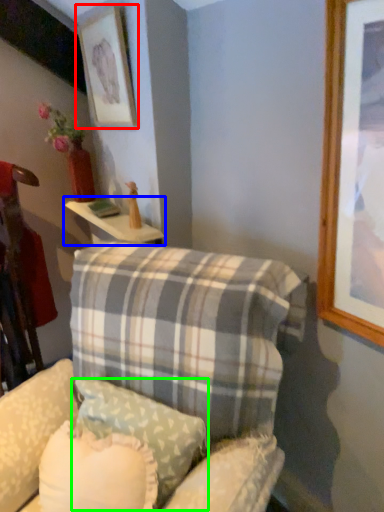
Question: Which is nearer to the picture frame (highlighted by a red box)? table (highlighted by a blue box) or pillow (highlighted by a green box).

Choices:
 (A) table
 (B) pillow

Answer: (A)